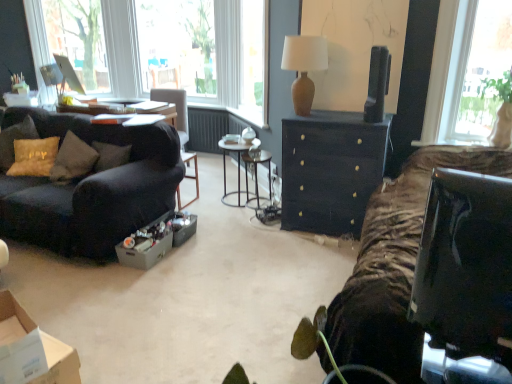
Identify the location of metallic silver side table at center. This screenshot has width=512, height=384. (238, 175).

Locate an element on the screen. metallic silver table at center is located at coordinates (257, 177).

Measure the distance between matte gray cardboard box at center and camera.

They are 9.62 feet apart.

Locate an element on the screen. This screenshot has height=384, width=512. matte brown vase at upper center is located at coordinates (304, 67).

You are a GUI agent. You are given a task and a screenshot of the screen. Output one action in this format:
    pyautogui.click(x=<x>, y=<y>)
    Task: Click on the velvet dark brown couch at left
    This screenshot has width=512, height=384.
    Given the screenshot: What is the action you would take?
    pyautogui.click(x=92, y=188)

Describe the element at coordinates (31, 350) in the screenshot. I see `brown cardboard box at lower left` at that location.

Describe the element at coordinates (377, 84) in the screenshot. I see `black glossy television at upper right` at that location.

The height and width of the screenshot is (384, 512). I want to click on metallic silver side table at center, so click(x=238, y=175).

From a real-world perspective, does gold textured pillow at left stand above zebra-patterned fabric at right?

No, from a real-world perspective, gold textured pillow at left is not on top of zebra-patterned fabric at right.

From the image's perspective, between gold textured pillow at left and zebra-patterned fabric at right, who is located below?

zebra-patterned fabric at right, from the image's perspective.

Consider the image. Is gold textured pillow at left not near zebra-patterned fabric at right?

gold textured pillow at left is positioned a significant distance from zebra-patterned fabric at right.

Find the location of a particular element. cardboard box in front of the metallic silver side table at center is located at coordinates (144, 254).

Which is in front, matte gray cardboard box at center or metallic silver side table at center?

matte gray cardboard box at center is in front.

Is matte gray cardboard box at center to the left or to the right of metallic silver side table at center in the image?

Clearly, matte gray cardboard box at center is on the left of metallic silver side table at center in the image.

Considering the relative sizes of matte gray cardboard box at center and metallic silver side table at center in the image provided, is matte gray cardboard box at center shorter than metallic silver side table at center?

Yes, matte gray cardboard box at center is shorter than metallic silver side table at center.

At what (x,y) coordinates should I click in order to perform the action: click on box located in front of the velvet dark brown couch at left. Please return your answer as a coordinate pair (x, y). Image resolution: width=512 pixels, height=384 pixels. Looking at the image, I should click on (31, 350).

Relative to velvet dark brown couch at left, is brown cardboard box at lower left in front or behind?

Clearly, brown cardboard box at lower left is in front of velvet dark brown couch at left.

Does brown cardboard box at lower left have a lesser width compared to velvet dark brown couch at left?

Yes, brown cardboard box at lower left is thinner than velvet dark brown couch at left.

From their relative heights in the image, would you say brown cardboard box at lower left is taller or shorter than velvet dark brown couch at left?

In the image, brown cardboard box at lower left appears to be shorter than velvet dark brown couch at left.

Which is in front, point (144, 163) or point (291, 40)?

The point (291, 40) is closer.

From the image's perspective, between velvet dark brown couch at left and matte brown vase at upper center, which one is located above?

matte brown vase at upper center appears higher in the image.

Considering the positions of objects velvet dark brown couch at left and matte brown vase at upper center in the image provided, who is more to the right, velvet dark brown couch at left or matte brown vase at upper center?

matte brown vase at upper center is more to the right.

Is matte glass screen at upper left, acting as the first window screen starting from the left, next to transparent glass window at upper center, placed as the 1th window screen when sorted from right to left, and touching it?

No, matte glass screen at upper left, acting as the first window screen starting from the left, is not in contact with transparent glass window at upper center, placed as the 1th window screen when sorted from right to left.

Which is more to the right, matte glass screen at upper left, acting as the first window screen starting from the left, or transparent glass window at upper center, the second window screen positioned from the left?

Positioned to the right is transparent glass window at upper center, the second window screen positioned from the left.

The height and width of the screenshot is (384, 512). Find the location of `window screen that appears on the right of matte glass screen at upper left, acting as the first window screen starting from the left`. window screen that appears on the right of matte glass screen at upper left, acting as the first window screen starting from the left is located at coordinates (177, 45).

Can you confirm if matte glass screen at upper left, placed as the 2th window screen when sorted from right to left, is bigger than transparent glass window at upper center, the second window screen positioned from the left?

No.

Is velvet dark brown couch at left a part of metallic silver table at center?

No, velvet dark brown couch at left is not a part of metallic silver table at center.

From the picture: Does metallic silver table at center turn towards velvet dark brown couch at left?

No, metallic silver table at center is not aimed at velvet dark brown couch at left.

Is metallic silver table at center in front of velvet dark brown couch at left?

No, metallic silver table at center is further to the viewer.

From the image's perspective, is metallic silver table at center above or below velvet dark brown couch at left?

From the image's perspective, metallic silver table at center appears above velvet dark brown couch at left.

Considering the sizes of transparent glass window at upper center, placed as the 1th window screen when sorted from right to left, and metallic silver side table at center in the image, is transparent glass window at upper center, placed as the 1th window screen when sorted from right to left, taller or shorter than metallic silver side table at center?

Clearly, transparent glass window at upper center, placed as the 1th window screen when sorted from right to left, is taller compared to metallic silver side table at center.

Considering the sizes of objects transparent glass window at upper center, the second window screen positioned from the left, and metallic silver side table at center in the image provided, who is smaller, transparent glass window at upper center, the second window screen positioned from the left, or metallic silver side table at center?

Smaller between the two is metallic silver side table at center.

At what (x,y) coordinates should I click in order to perform the action: click on side table lying on the right of transparent glass window at upper center, placed as the 1th window screen when sorted from right to left. Please return your answer as a coordinate pair (x, y). The width and height of the screenshot is (512, 384). Looking at the image, I should click on (238, 175).

The image size is (512, 384). In order to click on open above the gold textured pillow at left (from a real-world perspective) in this screenshot , I will do `click(395, 266)`.

Identify the location of cardboard box lying below the metallic silver side table at center (from the image's perspective). Image resolution: width=512 pixels, height=384 pixels. (144, 254).

Which object lies nearer to the anchor point velvet dark brown couch at left, zebra-patterned fabric at right or matte gray cardboard box at center?

matte gray cardboard box at center is closer to velvet dark brown couch at left.

When comparing their distances from brown cardboard box at lower left, does matte black dresser at center or matte gray cardboard box at center seem closer?

matte gray cardboard box at center.

Estimate the real-world distances between objects in this image. Which object is further from gold textured pillow at left, metallic silver table at center or matte brown vase at upper center?

matte brown vase at upper center is positioned further to the anchor gold textured pillow at left.

From the image, which object appears to be farther from metallic silver table at center, zebra-patterned fabric at right or transparent glass window at upper center, the second window screen positioned from the left?

transparent glass window at upper center, the second window screen positioned from the left, is positioned further to the anchor metallic silver table at center.

Considering their positions, is gold textured pillow at left positioned closer to metallic silver table at center than zebra-patterned fabric at right?

zebra-patterned fabric at right is closer to metallic silver table at center.

From the image, which object appears to be nearer to velvet dark brown couch at left, matte glass screen at upper left, placed as the 2th window screen when sorted from right to left, or brown cardboard box at lower left?

brown cardboard box at lower left is closer to velvet dark brown couch at left.

Based on their spatial positions, is matte glass screen at upper left, acting as the first window screen starting from the left, or metallic silver side table at center further from transparent glass window at upper center, the second window screen positioned from the left?

Based on the image, metallic silver side table at center appears to be further to transparent glass window at upper center, the second window screen positioned from the left.

Which object lies nearer to the anchor point transparent glass window at upper center, the second window screen positioned from the left, zebra-patterned fabric at right or brown cardboard box at lower left?

zebra-patterned fabric at right is closer to transparent glass window at upper center, the second window screen positioned from the left.

The image size is (512, 384). I want to click on television between transparent glass window at upper center, the second window screen positioned from the left, and matte gray cardboard box at center vertically, so click(377, 84).

The width and height of the screenshot is (512, 384). Find the location of `lamp between velvet dark brown couch at left and matte black dresser at center from left to right`. lamp between velvet dark brown couch at left and matte black dresser at center from left to right is located at coordinates (304, 67).

The height and width of the screenshot is (384, 512). In order to click on side table between matte glass screen at upper left, placed as the 2th window screen when sorted from right to left, and matte gray cardboard box at center from top to bottom in this screenshot , I will do `click(238, 175)`.

Find the location of `side table located between matte glass screen at upper left, acting as the first window screen starting from the left, and matte black dresser at center in the left-right direction`. side table located between matte glass screen at upper left, acting as the first window screen starting from the left, and matte black dresser at center in the left-right direction is located at coordinates (238, 175).